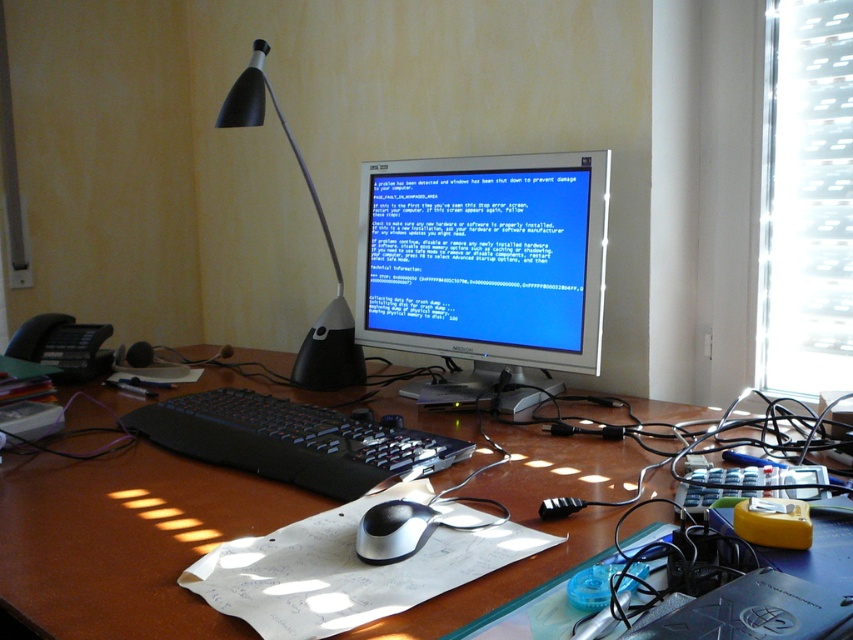
You are a technician trying to fix the CRT monitor displaying a blue screen error. You have a toolkit that requires 60 centimeters of space to work. Can you place your toolkit between the brown wooden desk at center and the CRT monitor?

The distance between the brown wooden desk at center and the CRT monitor is 63.25 centimeters, which is sufficient to accommodate the toolkit requiring 60 centimeters of space. Yes, you can place your toolkit there.

You are a technician standing 1.5 meters away from a desk. You need to adjust the black plastic desk lamp at upper center. Can you reach it without moving closer?

The black plastic desk lamp at upper center is 1.42 meters away from the camera, so since you are standing 1.5 meters away, you can just barely reach it without moving closer.

You are organizing the desk and want to place the sleek silver mouse at center closer to the edge of the desk. Considering the space occupied by the black plastic desk lamp at upper center, do you think there is enough room to move the mouse without overlapping?

The black plastic desk lamp at upper center might be wider than the sleek silver mouse at center, so there might not be enough space to move the mouse closer to the edge without overlapping.